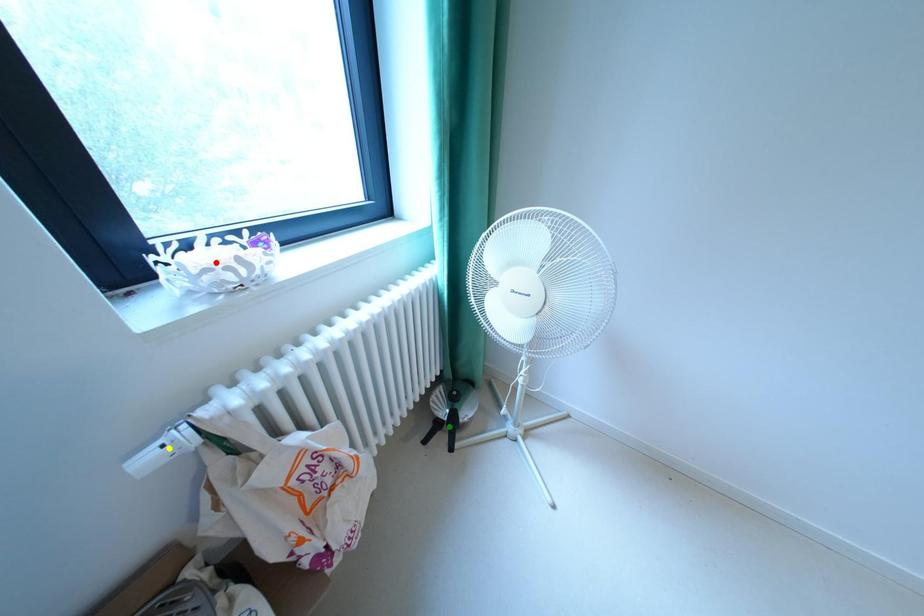
Order these from farthest to nearest:
- yellow point
- green point
- red point

green point, red point, yellow point